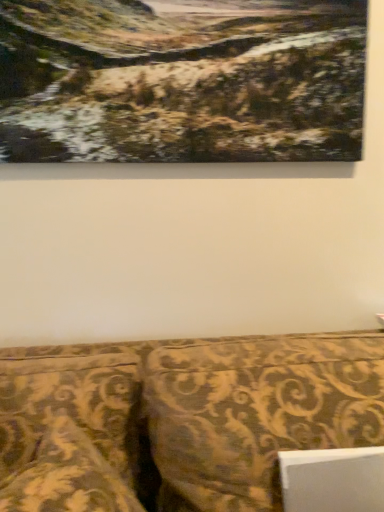
Identify the location of gold damask fabric couch at lower center. 180,419.

The image size is (384, 512). What do you see at coordinates (180, 419) in the screenshot? I see `gold damask fabric couch at lower center` at bounding box center [180, 419].

Measure the distance between gold damask fabric couch at lower center and camera.

gold damask fabric couch at lower center and camera are 20.59 inches apart from each other.

In order to click on gold damask fabric couch at lower center in this screenshot , I will do `click(180, 419)`.